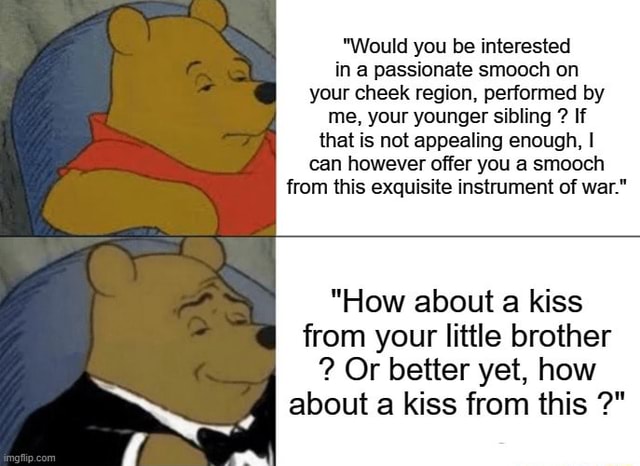
Where is `blue armchair`? blue armchair is located at coordinates (52, 336), (52, 102).